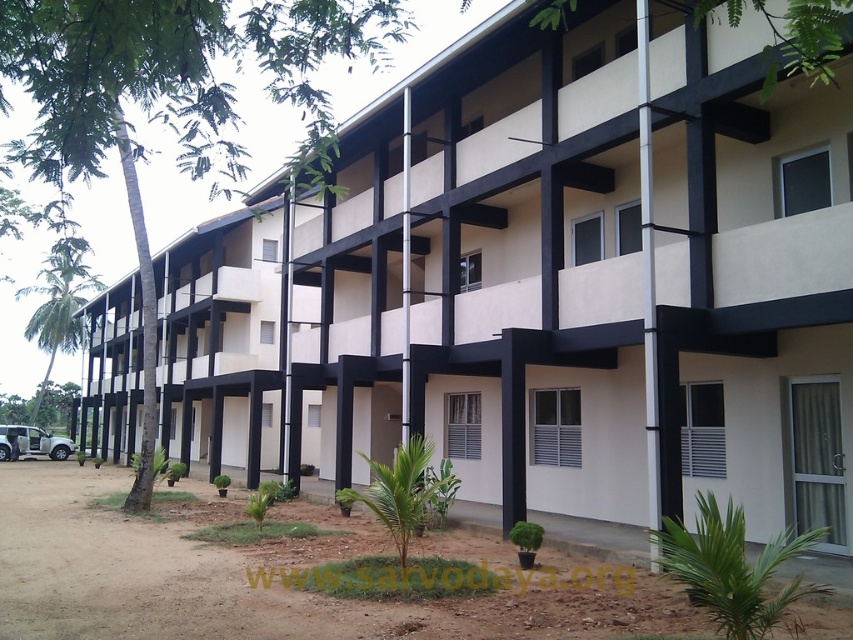
Is point (210, 163) farther from viewer compared to point (74, 346)?

No, (210, 163) is closer to viewer.

Does green leafy tree at left have a larger size compared to green leafy palm tree at left?

Yes, green leafy tree at left is bigger than green leafy palm tree at left.

Is point (236, 29) behind point (68, 268)?

No, (236, 29) is in front of (68, 268).

Locate an element on the screen. green leafy tree at left is located at coordinates (173, 99).